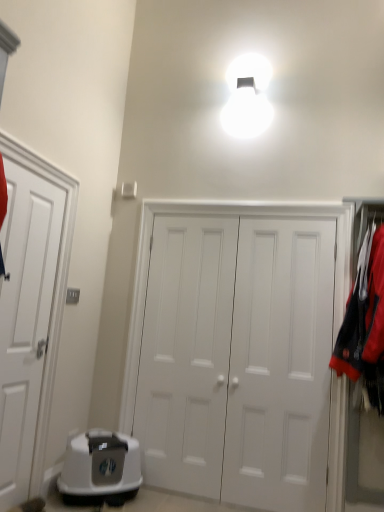
Identify the location of vacant area on top of white matte door at center, marked as the 2th door in a left-to-right arrangement (from a real-world perspective). This screenshot has width=384, height=512. (200, 211).